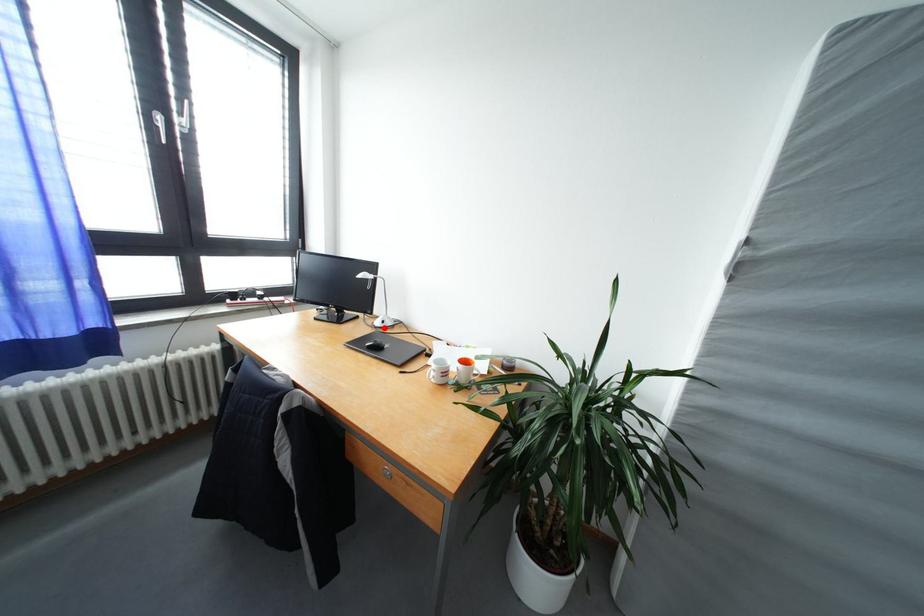
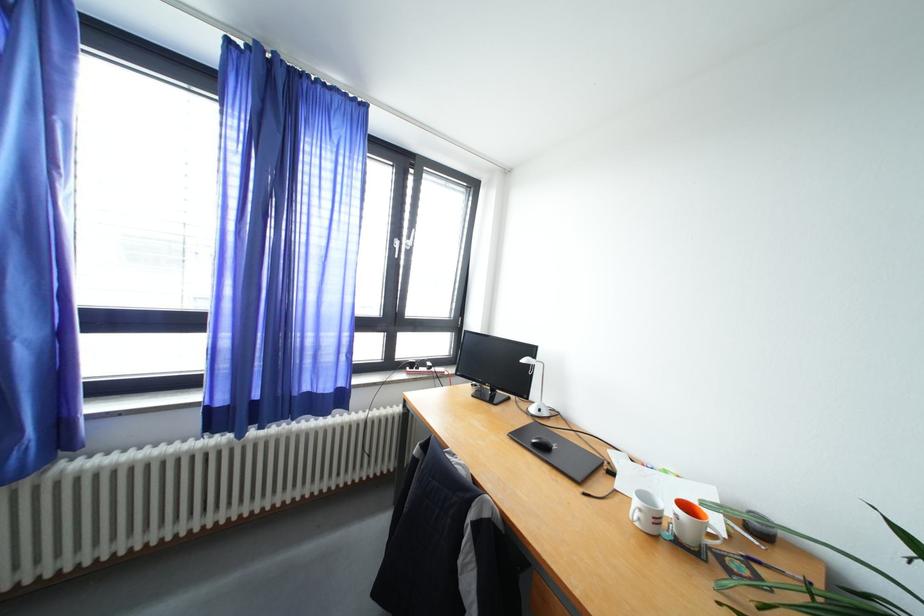
Find the pixel in the second image that matches the highlighted location in the first image.

(540, 415)